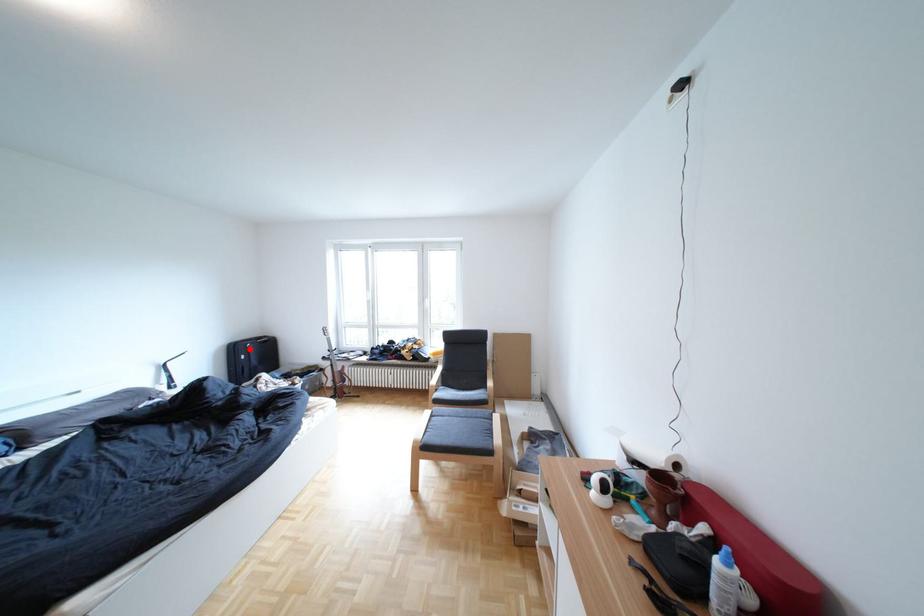
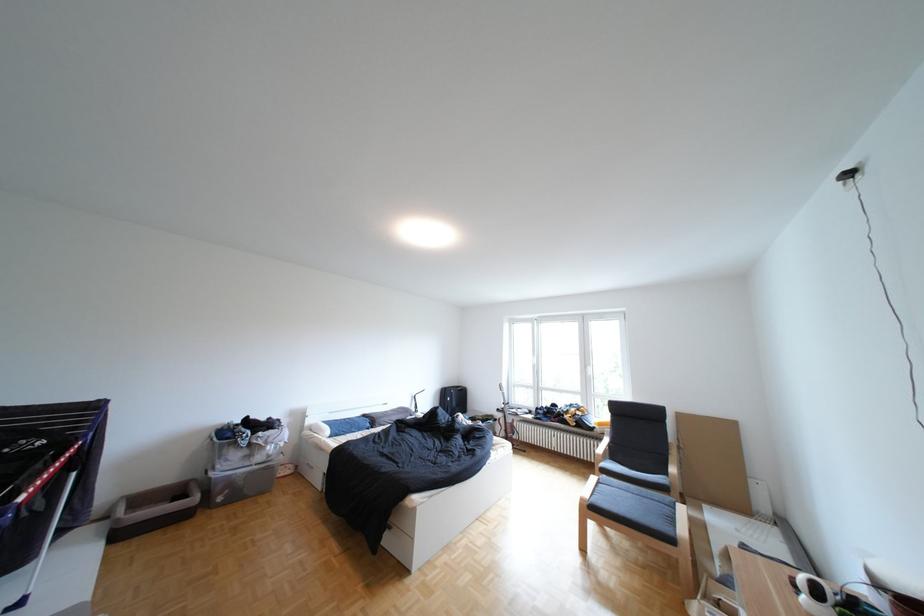
Locate, in the second image, the point that corresponds to the highlighted location in the first image.

(459, 392)